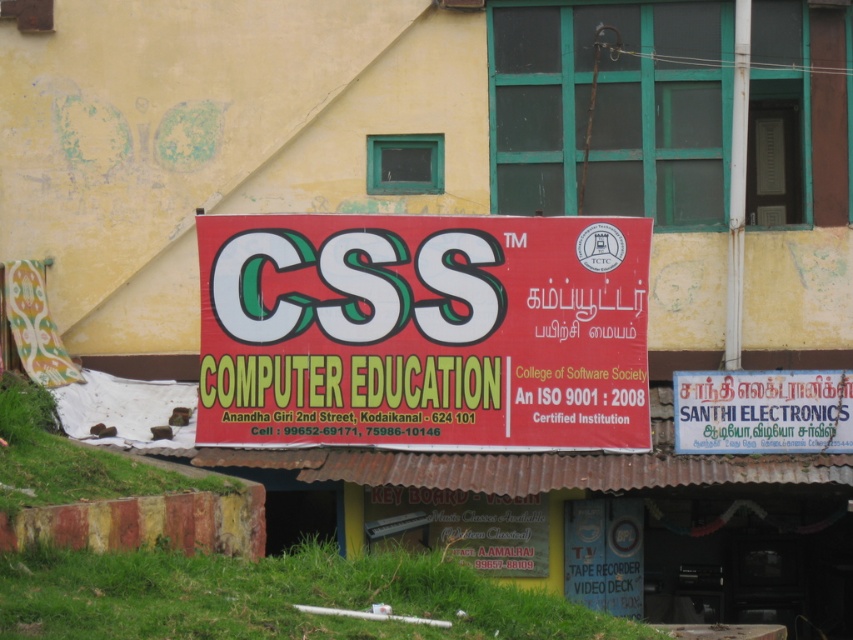
Question: Which point appears farthest from the camera in this image?

Choices:
 (A) (564, 310)
 (B) (833, 424)

Answer: (B)

Question: Does red matte signboard at center appear under white painted signboard at center?

Choices:
 (A) no
 (B) yes

Answer: (A)

Question: Can you confirm if red matte signboard at center is positioned to the left of white painted signboard at center?

Choices:
 (A) no
 (B) yes

Answer: (B)

Question: Is red matte signboard at center to the left of white painted signboard at center from the viewer's perspective?

Choices:
 (A) yes
 (B) no

Answer: (A)